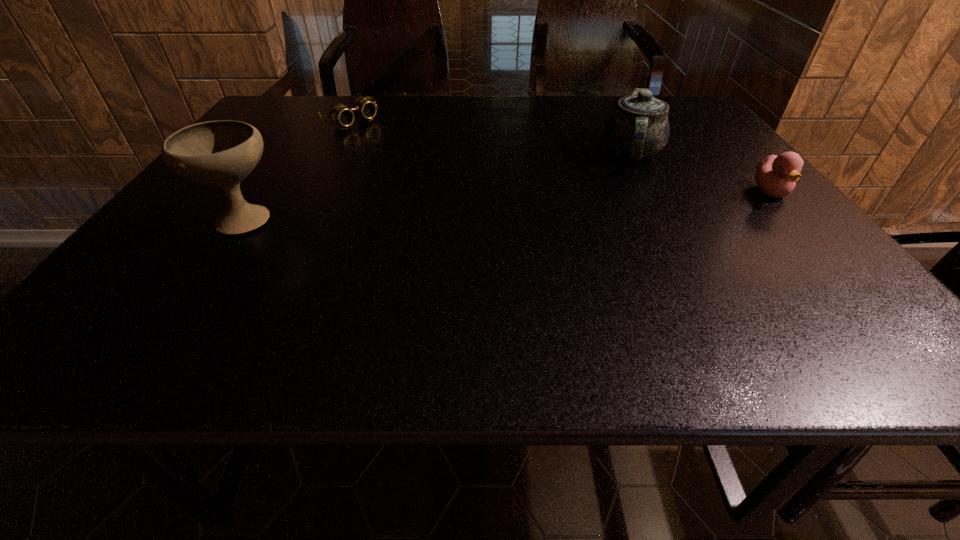
Locate an element on the screen. Image resolution: width=960 pixels, height=540 pixels. chalice is located at coordinates (222, 153).

At what (x,y) coordinates should I click in order to perform the action: click on the third tallest object. Please return your answer as a coordinate pair (x, y). This screenshot has height=540, width=960. Looking at the image, I should click on (776, 176).

Locate an element on the screen. The width and height of the screenshot is (960, 540). the rightmost object is located at coordinates (776, 176).

This screenshot has height=540, width=960. Identify the location of the shortest object. (339, 114).

The image size is (960, 540). Find the location of `the second object from right to left`. the second object from right to left is located at coordinates (638, 127).

This screenshot has width=960, height=540. In order to click on the third shortest object in this screenshot , I will do coord(638,127).

At what (x,y) coordinates should I click in order to perform the action: click on free space located on the right of the chalice. Please return your answer as a coordinate pair (x, y). This screenshot has width=960, height=540. Looking at the image, I should click on (437, 218).

Image resolution: width=960 pixels, height=540 pixels. Find the location of `free space located 0.060m on the front-facing side of the rightmost object`. free space located 0.060m on the front-facing side of the rightmost object is located at coordinates (799, 224).

Where is `free location located 0.340m through the lenses of the goggles`? This screenshot has height=540, width=960. free location located 0.340m through the lenses of the goggles is located at coordinates (444, 175).

The image size is (960, 540). What are the coordinates of `free space located 0.320m through the lenses of the goggles` in the screenshot? It's located at (439, 172).